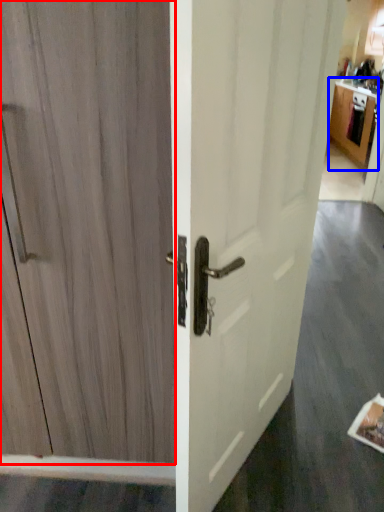
Question: Which object appears farthest to the camera in this image, door (highlighted by a red box) or cabinetry (highlighted by a blue box)?

Choices:
 (A) door
 (B) cabinetry

Answer: (B)